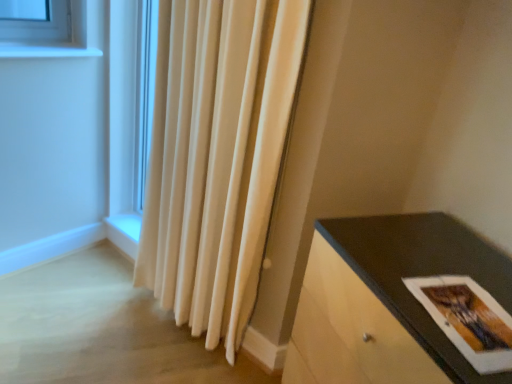
Question: Is matte paper postcard at lower right taller than matte black table at lower right?

Choices:
 (A) yes
 (B) no

Answer: (B)

Question: Is matte paper postcard at lower right in contact with matte black table at lower right?

Choices:
 (A) no
 (B) yes

Answer: (A)

Question: Considering the relative positions of matte paper postcard at lower right and matte black table at lower right in the image provided, is matte paper postcard at lower right behind matte black table at lower right?

Choices:
 (A) yes
 (B) no

Answer: (A)

Question: Is matte paper postcard at lower right thinner than matte black table at lower right?

Choices:
 (A) yes
 (B) no

Answer: (A)

Question: Can you confirm if matte paper postcard at lower right is smaller than matte black table at lower right?

Choices:
 (A) no
 (B) yes

Answer: (B)

Question: From a real-world perspective, is matte black table at lower right physically located above or below matte paper postcard at lower right?

Choices:
 (A) below
 (B) above

Answer: (A)

Question: Is matte black table at lower right to the left or to the right of matte paper postcard at lower right in the image?

Choices:
 (A) right
 (B) left

Answer: (B)

Question: Is matte black table at lower right wider or thinner than matte paper postcard at lower right?

Choices:
 (A) wide
 (B) thin

Answer: (A)

Question: Considering the positions of point (295, 334) and point (510, 332), is point (295, 334) closer or farther from the camera than point (510, 332)?

Choices:
 (A) closer
 (B) farther

Answer: (B)

Question: Is white velvet curtain at center in front of or behind matte paper postcard at lower right in the image?

Choices:
 (A) behind
 (B) front

Answer: (A)

Question: Is point (219, 87) positioned closer to the camera than point (474, 360)?

Choices:
 (A) farther
 (B) closer

Answer: (A)

Question: From a real-world perspective, is white velvet curtain at center positioned above or below matte paper postcard at lower right?

Choices:
 (A) below
 (B) above

Answer: (A)

Question: In terms of width, does white velvet curtain at center look wider or thinner when compared to matte paper postcard at lower right?

Choices:
 (A) wide
 (B) thin

Answer: (B)

Question: Based on their sizes in the image, would you say matte paper postcard at lower right is bigger or smaller than white velvet curtain at center?

Choices:
 (A) big
 (B) small

Answer: (B)

Question: Choose the correct answer: Is matte paper postcard at lower right inside white velvet curtain at center or outside it?

Choices:
 (A) outside
 (B) inside

Answer: (A)